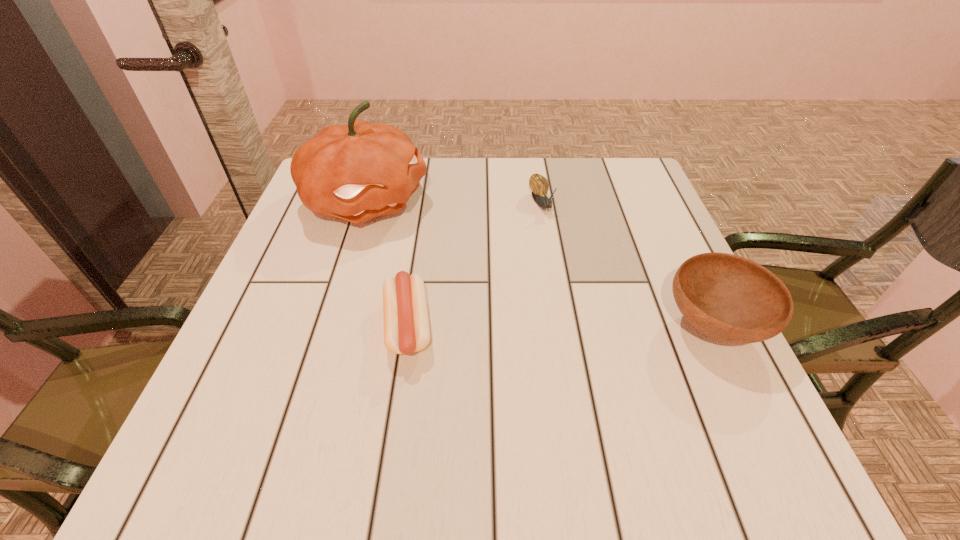
Identify the location of vacant area that lies between the sausage and the third shortest object. The width and height of the screenshot is (960, 540). (561, 326).

The width and height of the screenshot is (960, 540). I want to click on vacant space that is in between the sausage and the rightmost object, so click(561, 326).

Locate an element on the screen. This screenshot has width=960, height=540. vacant space that is in between the escargot and the sausage is located at coordinates (474, 266).

Find the location of a particular element. Image resolution: width=960 pixels, height=540 pixels. free area in between the rightmost object and the sausage is located at coordinates (561, 326).

This screenshot has width=960, height=540. What are the coordinates of `unoccupied area between the rightmost object and the tallest object` in the screenshot? It's located at (540, 263).

What are the coordinates of `the second closest object to the tallest object` in the screenshot? It's located at (539, 185).

You are a GUI agent. You are given a task and a screenshot of the screen. Output one action in this format:
    pyautogui.click(x=<x>, y=<y>)
    Task: Click on the second closest object to the sausage
    Image resolution: width=960 pixels, height=540 pixels.
    Given the screenshot: What is the action you would take?
    pyautogui.click(x=539, y=185)

At what (x,y) coordinates should I click in order to perform the action: click on free region that satisfies the following two spatial constraints: 1. on the back side of the second tallest object; 2. on the left side of the sausage. Please return your answer as a coordinate pair (x, y). Looking at the image, I should click on (408, 326).